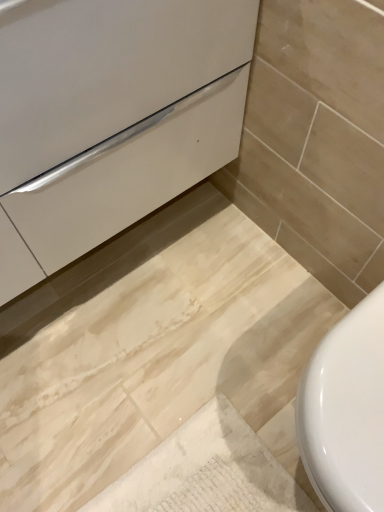
Question: Are white glossy drawer at center and white glossy toilet at lower right beside each other?

Choices:
 (A) yes
 (B) no

Answer: (B)

Question: From a real-world perspective, is white glossy drawer at center positioned under white glossy toilet at lower right based on gravity?

Choices:
 (A) no
 (B) yes

Answer: (A)

Question: Does white glossy drawer at center have a greater width compared to white glossy toilet at lower right?

Choices:
 (A) yes
 (B) no

Answer: (A)

Question: From the image's perspective, is white glossy drawer at center on white glossy toilet at lower right?

Choices:
 (A) yes
 (B) no

Answer: (A)

Question: From a real-world perspective, is white glossy drawer at center on white glossy toilet at lower right?

Choices:
 (A) no
 (B) yes

Answer: (B)

Question: Is white glossy drawer at center further to the viewer compared to white glossy toilet at lower right?

Choices:
 (A) yes
 (B) no

Answer: (B)

Question: Can you confirm if white glossy toilet at lower right is thinner than white glossy drawer at center?

Choices:
 (A) yes
 (B) no

Answer: (A)

Question: Does white glossy toilet at lower right have a lesser height compared to white glossy drawer at center?

Choices:
 (A) yes
 (B) no

Answer: (A)

Question: From a real-world perspective, is white glossy toilet at lower right beneath white glossy drawer at center?

Choices:
 (A) no
 (B) yes

Answer: (B)

Question: Is white glossy drawer at center inside white glossy toilet at lower right?

Choices:
 (A) no
 (B) yes

Answer: (A)

Question: Can you confirm if white glossy toilet at lower right is positioned to the right of white glossy drawer at center?

Choices:
 (A) yes
 (B) no

Answer: (A)

Question: Is white glossy toilet at lower right smaller than white glossy drawer at center?

Choices:
 (A) yes
 (B) no

Answer: (A)

Question: Does point (97, 180) appear closer or farther from the camera than point (317, 370)?

Choices:
 (A) closer
 (B) farther

Answer: (B)